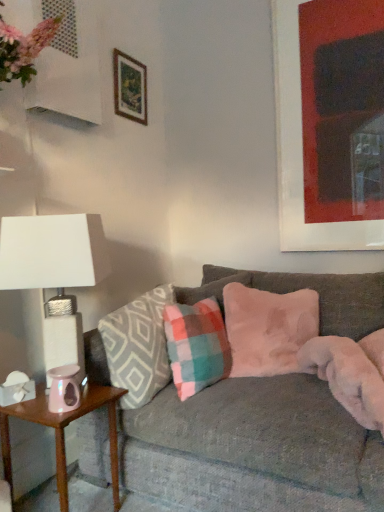
Image resolution: width=384 pixels, height=512 pixels. I want to click on free space to the left of iridescent glass candle holder at lower left, so click(x=35, y=407).